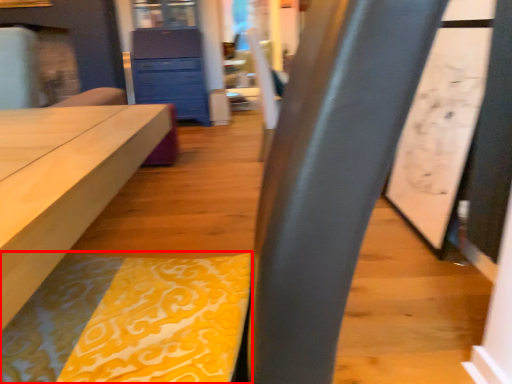
Question: From the image's perspective, what is the correct spatial positioning of blanket (annotated by the red box) in reference to chest of drawers?

Choices:
 (A) below
 (B) above

Answer: (A)